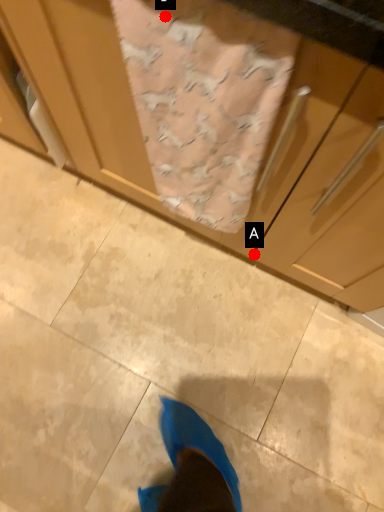
Question: Two points are circled on the image, labeled by A and B beside each circle. Among these points, which one is farthest from the camera?

Choices:
 (A) A is further
 (B) B is further

Answer: (A)